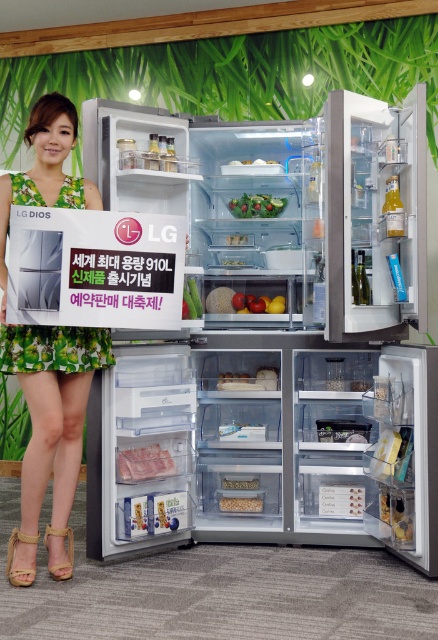
You are a customer in a home appliance store and see the green floral dress at left and the green leafy salad at center inside the open refrigerator. Which item takes up more horizontal space in the fridge?

The green floral dress at left takes up more horizontal space in the fridge because its width surpasses that of the green leafy salad at center.

You are a delivery person who just arrived at a house to deliver a new refrigerator. You see the sleek stainless steel refrigerator at center and the green floral dress at left. Which object is taller?

The sleek stainless steel refrigerator at center is taller than the green floral dress at left.

You are a customer at an appliance store and see the green floral dress at left and the green leafy salad at center inside the open refrigerator. Which item takes up more space inside the fridge?

The green floral dress at left is larger in size than the green leafy salad at center, so it takes up more space inside the fridge.